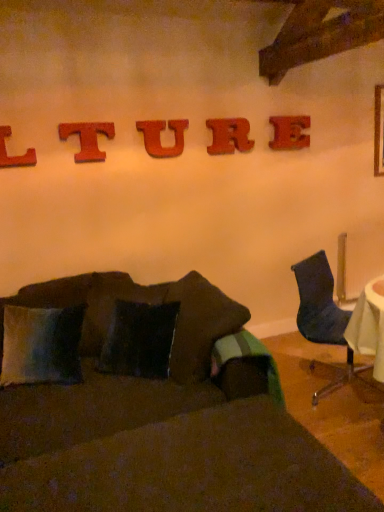
Question: Can you confirm if red wood u at center, which is counted as the 3th alphabet, starting from the left, is wider than velvety blue pillow at lower left?

Choices:
 (A) no
 (B) yes

Answer: (A)

Question: Does red wood u at center, which is counted as the 3th alphabet, starting from the left, have a greater height compared to velvety blue pillow at lower left?

Choices:
 (A) yes
 (B) no

Answer: (B)

Question: Can you confirm if red wood u at center, which is counted as the 3th alphabet, starting from the left, is shorter than velvety blue pillow at lower left?

Choices:
 (A) no
 (B) yes

Answer: (B)

Question: Can you confirm if red wood u at center, which ranks as the 3th alphabet in right-to-left order, is positioned to the right of velvety blue pillow at lower left?

Choices:
 (A) no
 (B) yes

Answer: (B)

Question: Is red wood u at center, which is counted as the 3th alphabet, starting from the left, at the left side of velvety blue pillow at lower left?

Choices:
 (A) yes
 (B) no

Answer: (B)

Question: From the image's perspective, is red wood u at center, which ranks as the 3th alphabet in right-to-left order, below velvety blue pillow at lower left?

Choices:
 (A) yes
 (B) no

Answer: (B)

Question: From a real-world perspective, is velvet dark blue chair at right located beneath wooden letter e at upper center, marked as the 1th alphabet in a right-to-left arrangement?

Choices:
 (A) no
 (B) yes

Answer: (B)

Question: Is velvet dark blue chair at right at the right side of wooden letter e at upper center, marked as the 1th alphabet in a right-to-left arrangement?

Choices:
 (A) no
 (B) yes

Answer: (B)

Question: From a real-world perspective, does velvet dark blue chair at right stand above wooden letter e at upper center, marked as the 1th alphabet in a right-to-left arrangement?

Choices:
 (A) yes
 (B) no

Answer: (B)

Question: Does velvet dark blue chair at right have a lesser width compared to wooden letter e at upper center, marked as the 1th alphabet in a right-to-left arrangement?

Choices:
 (A) yes
 (B) no

Answer: (B)

Question: Is velvet dark blue chair at right located outside wooden letter e at upper center, marked as the 1th alphabet in a right-to-left arrangement?

Choices:
 (A) no
 (B) yes

Answer: (B)

Question: Is there a large distance between velvet dark blue chair at right and wooden letter e at upper center, marked as the 1th alphabet in a right-to-left arrangement?

Choices:
 (A) yes
 (B) no

Answer: (A)

Question: Does red wood u at center, which ranks as the 3th alphabet in right-to-left order, have a lesser height compared to red wood letter t at upper center, the 2th alphabet positioned from the left?

Choices:
 (A) yes
 (B) no

Answer: (B)